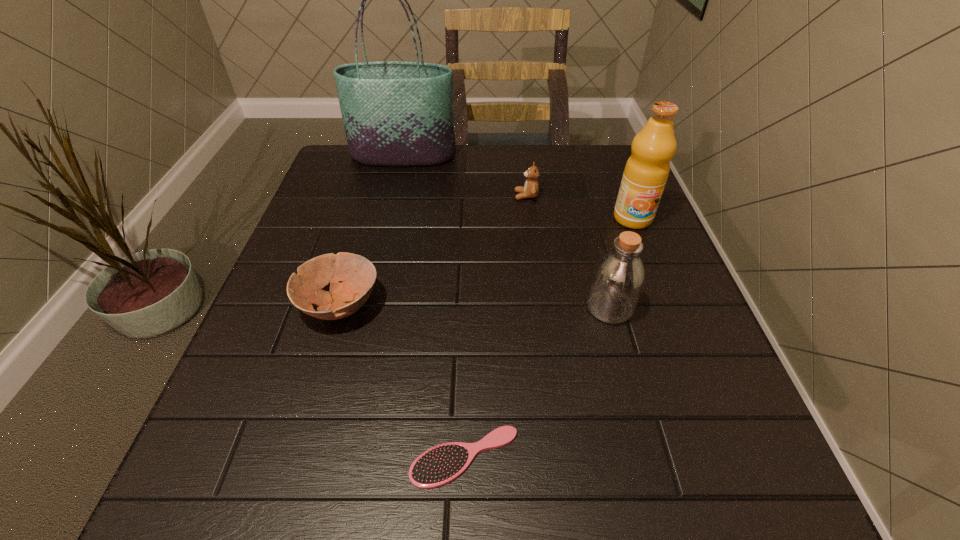
In order to click on teddy bear present at the far edge in this screenshot , I will do tap(531, 188).

This screenshot has height=540, width=960. Identify the location of object located at the near edge. (439, 465).

I want to click on tote bag that is at the left edge, so click(395, 113).

At what (x,y) coordinates should I click in order to perform the action: click on bowl located at the left edge. Please return your answer as a coordinate pair (x, y). This screenshot has height=540, width=960. Looking at the image, I should click on 358,275.

Identify the location of fruit juice that is at the right edge. (646, 172).

What are the coordinates of `bottle at the right edge` in the screenshot? It's located at (618, 278).

You are a GUI agent. You are given a task and a screenshot of the screen. Output one action in this format:
    pyautogui.click(x=<x>, y=<y>)
    Task: Click on the object that is positioned at the far left corner
    
    Given the screenshot: What is the action you would take?
    pyautogui.click(x=395, y=113)

The width and height of the screenshot is (960, 540). Find the location of `vacant area at the far edge of the desktop`. vacant area at the far edge of the desktop is located at coordinates (523, 154).

This screenshot has width=960, height=540. Find the location of `vacant space at the near edge`. vacant space at the near edge is located at coordinates (375, 461).

This screenshot has width=960, height=540. What are the coordinates of `free region at the left edge of the desktop` in the screenshot? It's located at (262, 397).